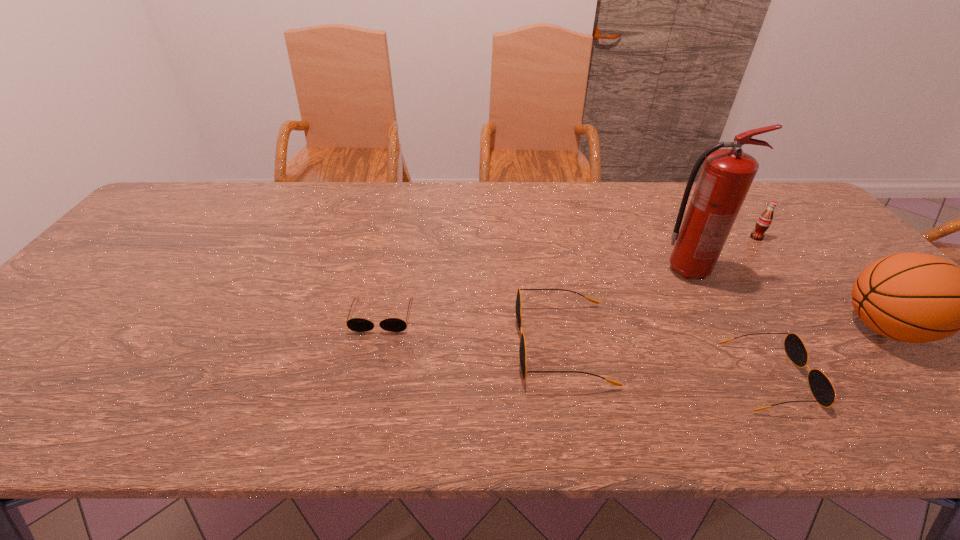
Identify the location of unoccupied area between the fifth shortest object and the tallest object. The image size is (960, 540). (785, 299).

Locate an element on the screen. vacant area that lies between the fire extinguisher and the fifth tallest object is located at coordinates tap(728, 323).

Find the location of a particular element. blank region between the tallest object and the shortest sunglasses is located at coordinates (535, 293).

Find the location of a particular element. The width and height of the screenshot is (960, 540). free space between the tallest object and the third tallest object is located at coordinates (722, 254).

You are a GUI agent. You are given a task and a screenshot of the screen. Output one action in this format:
    pyautogui.click(x=<x>, y=<y>)
    Task: Click on the free space that is in between the second tallest sunglasses and the fifth nearest object
    The height and width of the screenshot is (540, 960).
    Given the screenshot: What is the action you would take?
    pyautogui.click(x=728, y=323)

What are the coordinates of `empty space between the second tallest sunglasses and the fire extinguisher` in the screenshot? It's located at (728, 323).

Identify the location of free space between the fifth nearest object and the rightmost sunglasses. The image size is (960, 540). (728, 323).

This screenshot has height=540, width=960. Identify the location of free spot between the shortest sunglasses and the second shortest object. (575, 346).

Find the location of a particular element. Image resolution: width=960 pixels, height=540 pixels. object that stands as the third closest to the leftmost object is located at coordinates (821, 387).

Where is `object that is the third closest to the second tallest object`? The image size is (960, 540). object that is the third closest to the second tallest object is located at coordinates (764, 221).